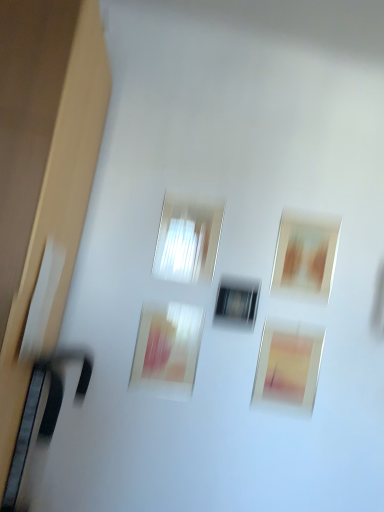
Question: Is transparent glass window at center, which ranks as the first window in left-to-right order, next to matte brown picture frame at upper right, which ranks as the first picture frame in right-to-left order, and touching it?

Choices:
 (A) yes
 (B) no

Answer: (B)

Question: Can you confirm if transparent glass window at center, which is the second window in right-to-left order, is thinner than matte brown picture frame at upper right, which ranks as the first picture frame in right-to-left order?

Choices:
 (A) yes
 (B) no

Answer: (B)

Question: Does transparent glass window at center, which ranks as the first window in left-to-right order, have a lesser height compared to matte brown picture frame at upper right, the 3th picture frame in the left-to-right sequence?

Choices:
 (A) yes
 (B) no

Answer: (B)

Question: From the image's perspective, does transparent glass window at center, arranged as the 1th window when viewed from the top, appear higher than matte brown picture frame at upper right, the 3th picture frame in the left-to-right sequence?

Choices:
 (A) yes
 (B) no

Answer: (A)

Question: Is matte brown picture frame at upper right, the 3th picture frame in the left-to-right sequence, inside transparent glass window at center, which is the second window from bottom to top?

Choices:
 (A) yes
 (B) no

Answer: (B)

Question: Considering the relative positions of matte pink picture frame at lower center, which is the second picture frame in right-to-left order, and transparent glass window at center, the 1th window positioned from the bottom, in the image provided, is matte pink picture frame at lower center, which is the second picture frame in right-to-left order, to the left or to the right of transparent glass window at center, the 1th window positioned from the bottom,?

Choices:
 (A) right
 (B) left

Answer: (A)

Question: In terms of height, does matte pink picture frame at lower center, which is the second picture frame in right-to-left order, look taller or shorter compared to transparent glass window at center, marked as the second window in a left-to-right arrangement?

Choices:
 (A) short
 (B) tall

Answer: (B)

Question: Considering the positions of point (297, 412) and point (235, 287), is point (297, 412) closer or farther from the camera than point (235, 287)?

Choices:
 (A) closer
 (B) farther

Answer: (A)

Question: From a real-world perspective, relative to transparent glass window at center, marked as the second window in a left-to-right arrangement, is matte pink picture frame at lower center, which is the 2th picture frame in left-to-right order, vertically above or below?

Choices:
 (A) below
 (B) above

Answer: (A)

Question: Would you say matte pink picture frame at lower center, which is the 2th picture frame in left-to-right order, is to the left or to the right of matte brown picture frame at upper right, which ranks as the first picture frame in right-to-left order, in the picture?

Choices:
 (A) left
 (B) right

Answer: (A)

Question: From a real-world perspective, is matte pink picture frame at lower center, which is the 2th picture frame in left-to-right order, physically located above or below matte brown picture frame at upper right, which ranks as the first picture frame in right-to-left order?

Choices:
 (A) below
 (B) above

Answer: (A)

Question: Looking at the image, does matte pink picture frame at lower center, which is the second picture frame in right-to-left order, seem bigger or smaller compared to matte brown picture frame at upper right, the 3th picture frame in the left-to-right sequence?

Choices:
 (A) big
 (B) small

Answer: (A)

Question: Is point (281, 369) positioned closer to the camera than point (329, 265)?

Choices:
 (A) closer
 (B) farther

Answer: (A)

Question: From a real-world perspective, is matte brown picture frame at upper right, the 3th picture frame in the left-to-right sequence, above or below matte pink painting at center, marked as the 3th picture frame in a right-to-left arrangement?

Choices:
 (A) above
 (B) below

Answer: (A)

Question: Is point (281, 217) positioned closer to the camera than point (190, 362)?

Choices:
 (A) closer
 (B) farther

Answer: (B)